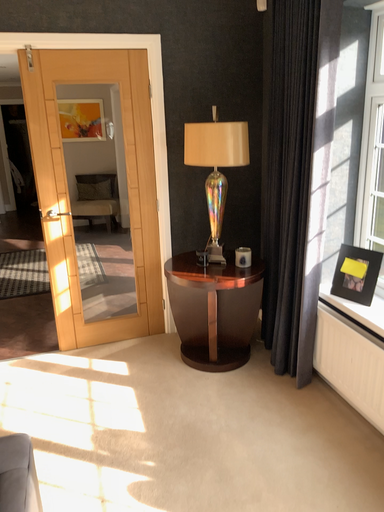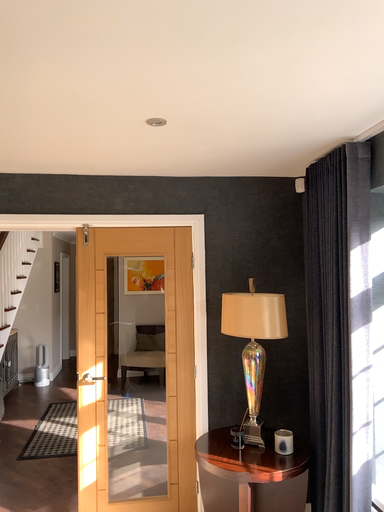
Question: How did the camera likely rotate when shooting the video?

Choices:
 (A) rotated upward
 (B) rotated downward

Answer: (A)